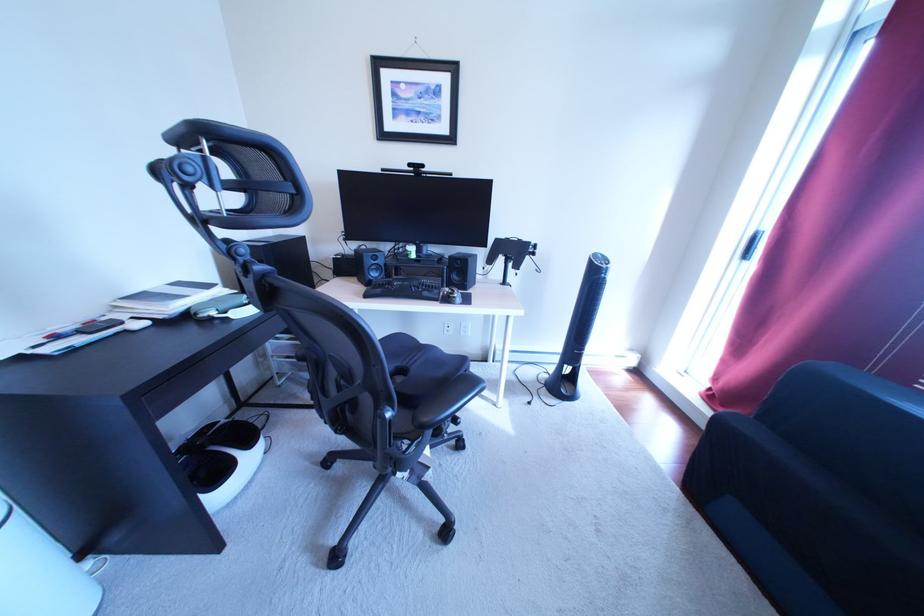
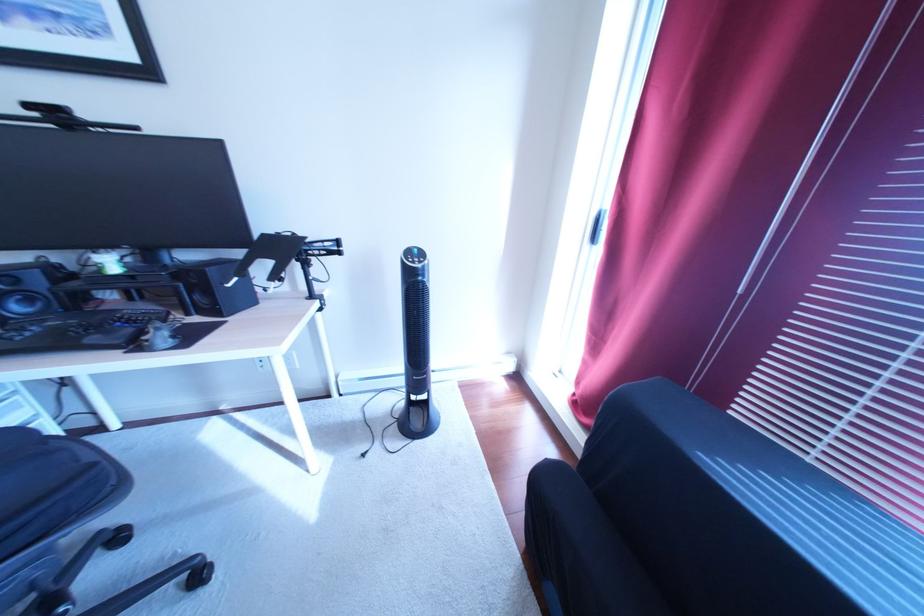
Question: The camera is either moving clockwise (left) or counter-clockwise (right) around the object. The first image is from the beginning of the video and the second image is from the end. Is the camera moving left or right when shooting the video?

Choices:
 (A) Left
 (B) Right

Answer: (A)